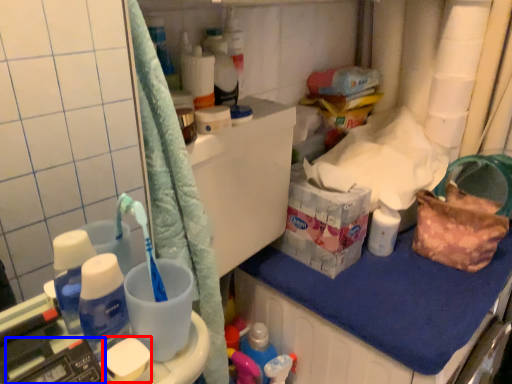
Question: Which of the following is the farthest to the observer, soap (highlighted by a red box) or scale (highlighted by a blue box)?

Choices:
 (A) soap
 (B) scale

Answer: (A)